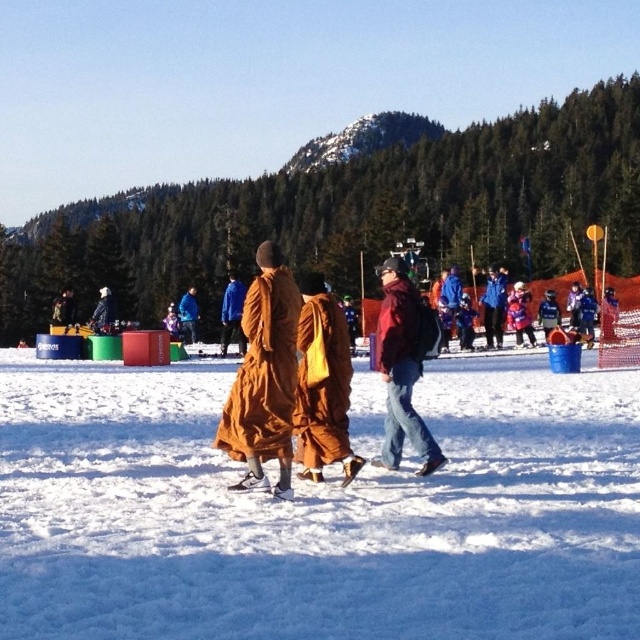
You are a photographer standing in the snowy scene. You notice the white fluffy snow at center and the brown fabric robe at center. Which object is closer to the ground?

The white fluffy snow at center is located below brown fabric robe at center, so it is closer to the ground.